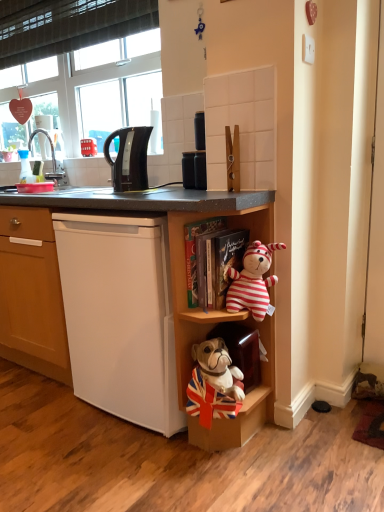
Find the location of a particular element. This screenshot has height=512, width=384. vacant space in front of white matte refrigerator at lower left is located at coordinates (138, 465).